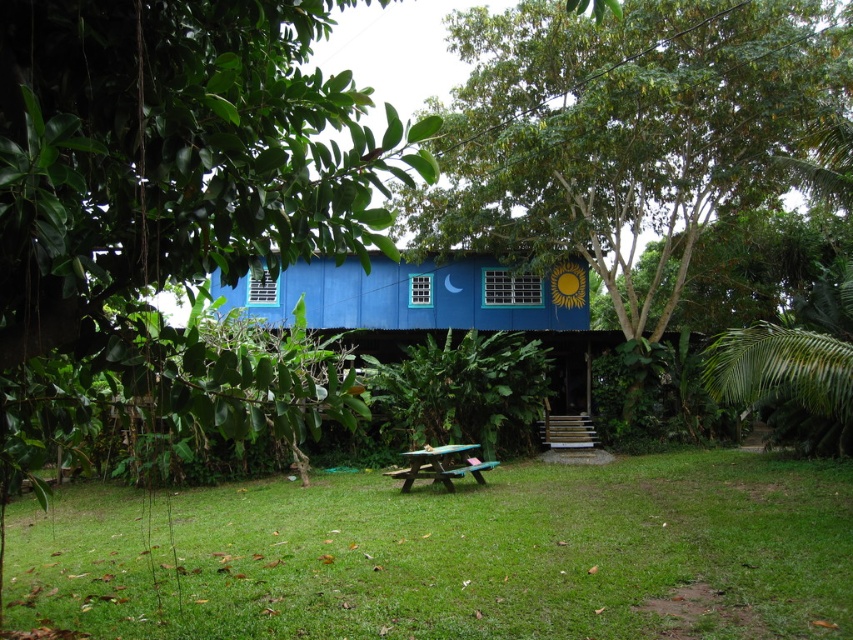
You are planning to place a large picnic blanket between the green leafy tree at left and the blue painted wood hut at center. Considering their sizes, will the space between them be wide enough to accommodate the blanket?

The green leafy tree at left has a lesser width compared to blue painted wood hut at center, so the space between them may be sufficient to place the picnic blanket, but it depends on the exact dimensions of the blanket.

You are planning to have a picnic at the wooden picnic table at center. You want to sit facing away from the green leafy tree at center. In which direction should you face?

You should face to the left because the green leafy tree at center is to the right of the wooden picnic table at center, so facing away from it would mean turning left.